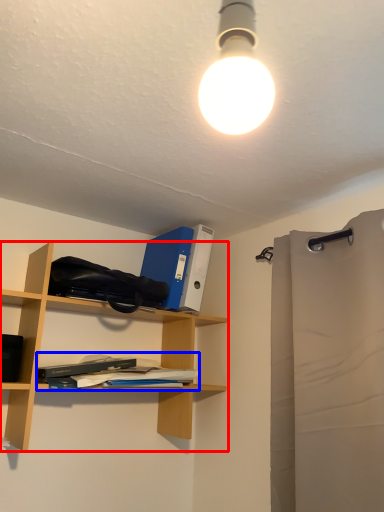
Question: Which of the following is the closest to the observer, shelf (highlighted by a red box) or book (highlighted by a blue box)?

Choices:
 (A) shelf
 (B) book

Answer: (A)